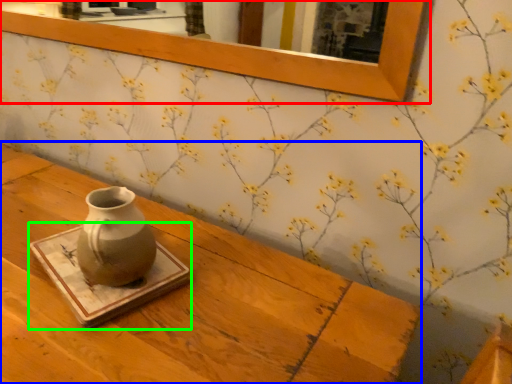
Question: Which object is positioned farthest from picture frame (highlighted by a red box)? Select from table (highlighted by a blue box) and tray (highlighted by a green box).

Choices:
 (A) table
 (B) tray

Answer: (B)